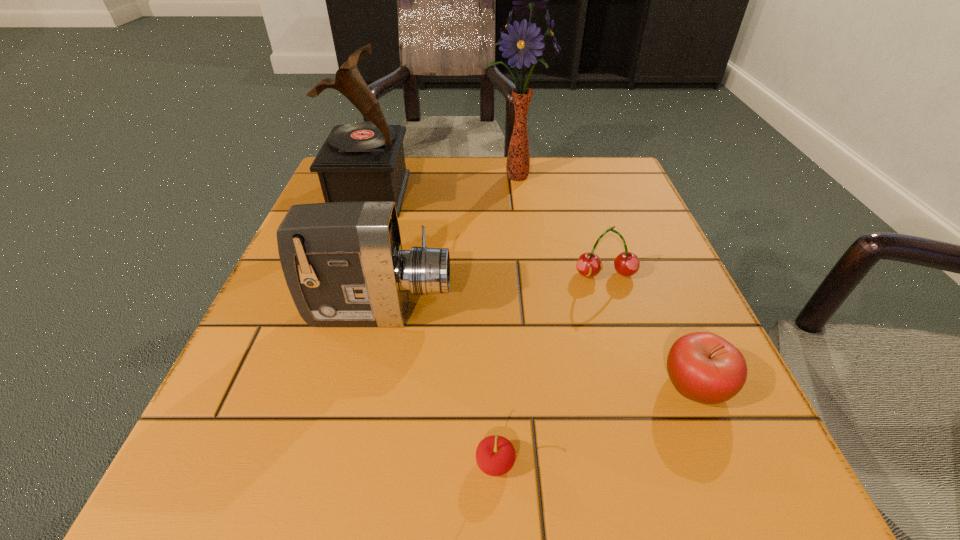
Where is `flower arrangement`? The width and height of the screenshot is (960, 540). flower arrangement is located at coordinates (524, 43).

Image resolution: width=960 pixels, height=540 pixels. Identify the location of the fifth shortest object. (359, 162).

Locate an element on the screen. Image resolution: width=960 pixels, height=540 pixels. the fourth farthest object is located at coordinates (343, 262).

The image size is (960, 540). I want to click on camcorder, so click(343, 262).

Find the location of a particular element. This screenshot has width=960, height=540. the right cherry is located at coordinates (589, 264).

At what (x,y) coordinates should I click in order to perform the action: click on the taller cherry. Please return your answer as a coordinate pair (x, y). The image size is (960, 540). Looking at the image, I should click on (589, 264).

Identify the location of apple. (703, 367).

The width and height of the screenshot is (960, 540). What are the coordinates of `the shorter cherry` in the screenshot? It's located at (495, 455).

You are a GUI agent. You are given a task and a screenshot of the screen. Output one action in this format:
    pyautogui.click(x=<x>, y=<y>)
    Task: Click on the nearest object
    
    Given the screenshot: What is the action you would take?
    pyautogui.click(x=495, y=455)

At what (x,y) coordinates should I click in order to perform the action: click on free space located on the front of the tallest object. Please return your answer as a coordinate pair (x, y). Looking at the image, I should click on (520, 221).